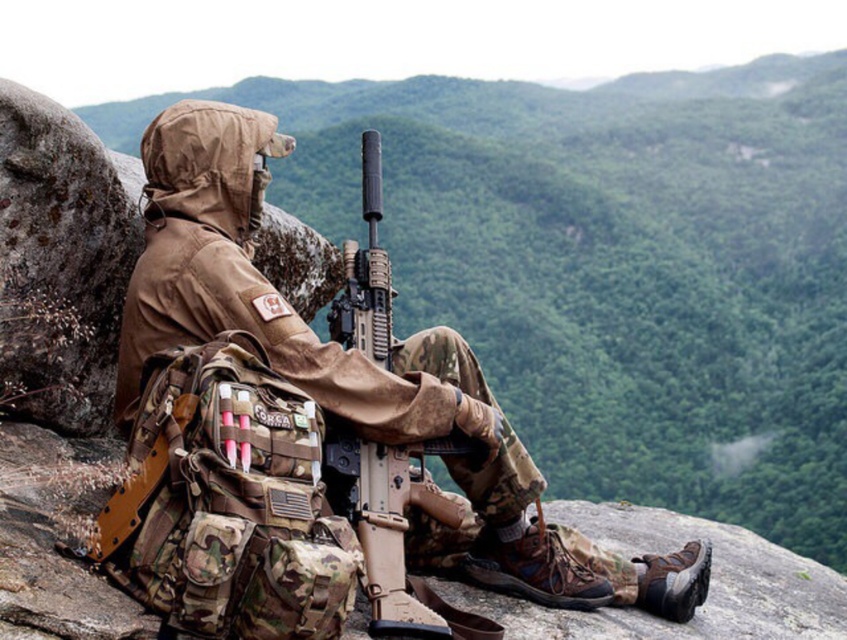
Question: Which point is farther to the camera?

Choices:
 (A) (408, 440)
 (B) (372, 198)

Answer: (B)

Question: Does camo fabric uniform at center have a smaller size compared to matte black rifle at center?

Choices:
 (A) yes
 (B) no

Answer: (B)

Question: Does camo fabric uniform at center appear on the right side of matte black rifle at center?

Choices:
 (A) yes
 (B) no

Answer: (A)

Question: Does camo fabric uniform at center have a greater width compared to matte black rifle at center?

Choices:
 (A) yes
 (B) no

Answer: (A)

Question: Among these objects, which one is farthest from the camera?

Choices:
 (A) matte black rifle at center
 (B) camo fabric uniform at center

Answer: (B)